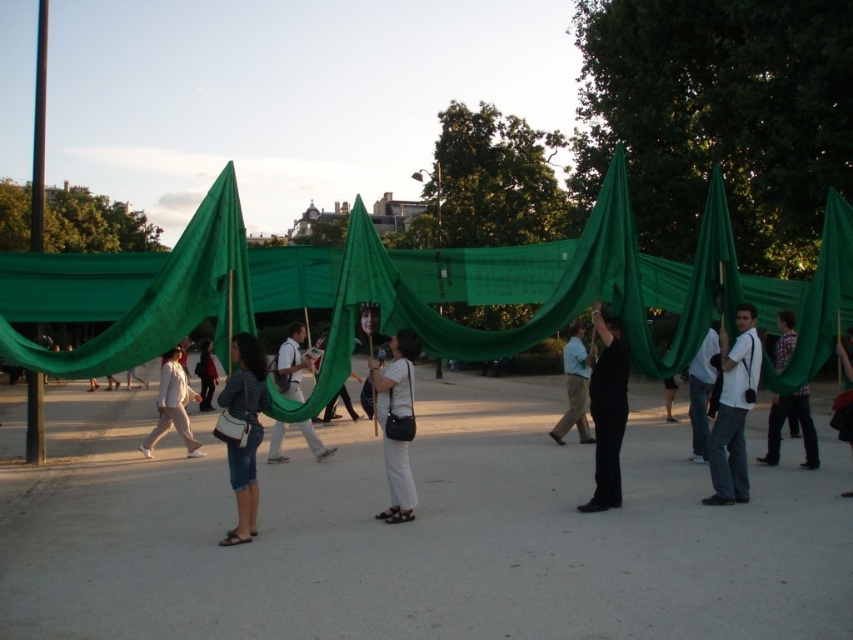
Question: Which point is farther to the camera?

Choices:
 (A) tap(201, 404)
 (B) tap(669, 397)
 (C) tap(850, 392)

Answer: (A)

Question: Which point is farther to the camera?

Choices:
 (A) (410, 385)
 (B) (709, 353)
 (C) (282, 385)
 (D) (798, 392)

Answer: (C)

Question: From the image, what is the correct spatial relationship of white cotton jacket at center in relation to denim shorts at center?

Choices:
 (A) left
 (B) right

Answer: (B)

Question: Does white matte bag at center have a greater width compared to black fabric at center?

Choices:
 (A) yes
 (B) no

Answer: (B)

Question: Considering the relative positions of white fabric backpack at center and dark gray pants at center in the image provided, where is white fabric backpack at center located with respect to dark gray pants at center?

Choices:
 (A) above
 (B) below

Answer: (B)

Question: Which of the following is the farthest from the observer?

Choices:
 (A) [x=199, y=410]
 (B) [x=180, y=412]

Answer: (A)